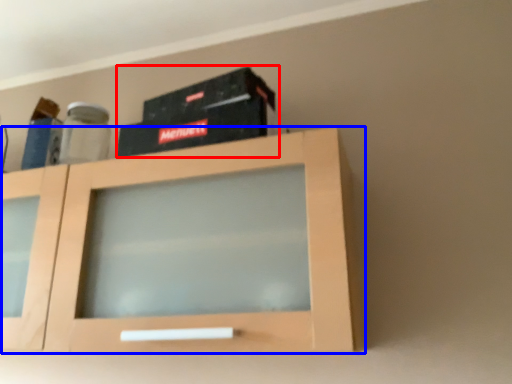
Question: Which object is further to the camera taking this photo, box (highlighted by a red box) or cabinetry (highlighted by a blue box)?

Choices:
 (A) box
 (B) cabinetry

Answer: (A)